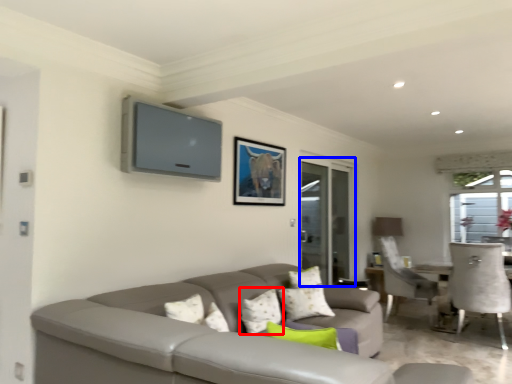
Question: Which object is further to the camera taking this photo, pillow (highlighted by a red box) or screen door (highlighted by a blue box)?

Choices:
 (A) pillow
 (B) screen door

Answer: (B)